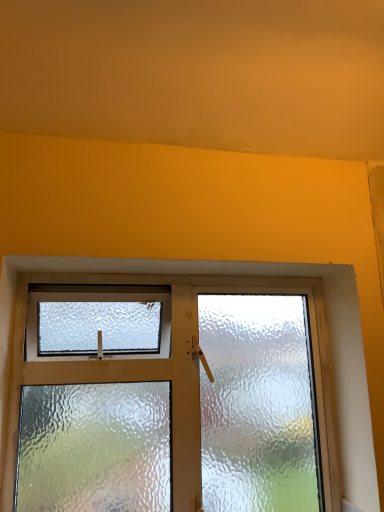
In order to face frosted glass window at center, should I rotate leftwards or rightwards?

It's best to rotate left around 2.060 degrees.

What do you see at coordinates (266, 275) in the screenshot? The width and height of the screenshot is (384, 512). I see `frosted glass window at center` at bounding box center [266, 275].

Find the location of a particular element. The width and height of the screenshot is (384, 512). frosted glass window at center is located at coordinates (266, 275).

The image size is (384, 512). Identify the location of frosted glass window at center. (266, 275).